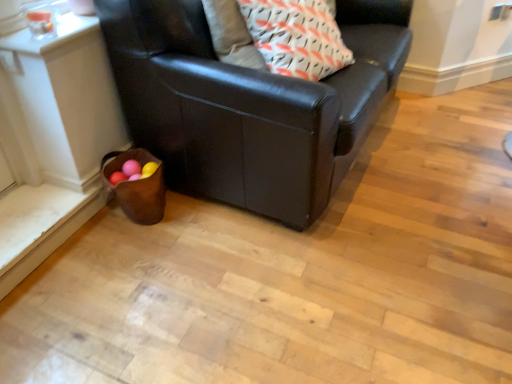
Locate an element on the screen. The height and width of the screenshot is (384, 512). vacant area that is in front of black leather couch at lower left is located at coordinates (286, 281).